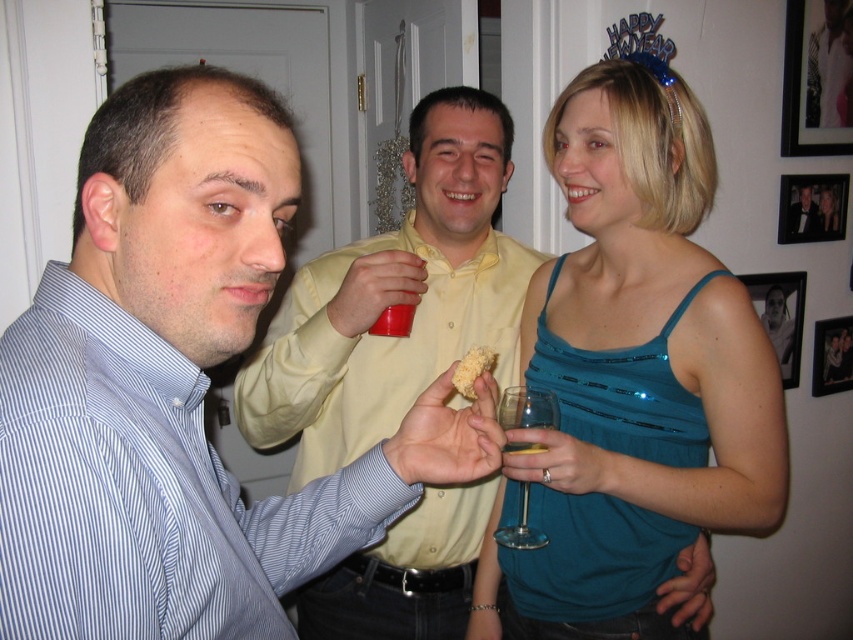
Question: Does matte black frame at upper right appear on the right side of metallic silver frame at upper right?

Choices:
 (A) no
 (B) yes

Answer: (A)

Question: Does metallic silver photo frame at upper right appear over black satin tuxedo at upper right?

Choices:
 (A) no
 (B) yes

Answer: (A)

Question: Estimate the real-world distances between objects in this image. Which object is farther from the matte black frame at upper right?

Choices:
 (A) black glossy picture frame at upper right
 (B) metallic silver frame at upper right

Answer: (B)

Question: Is transparent glass wine glass at lower center below black satin tuxedo at upper right?

Choices:
 (A) no
 (B) yes

Answer: (B)

Question: Considering the real-world distances, which object is closest to the crumbly yellow bread at center?

Choices:
 (A) metallic silver frame at upper right
 (B) black satin tuxedo at upper right
 (C) black glossy picture frame at upper right
 (D) blue striped shirt at left

Answer: (D)

Question: Which of the following is the farthest from the observer?

Choices:
 (A) metallic silver photo frame at upper right
 (B) black glossy picture frame at upper right

Answer: (A)